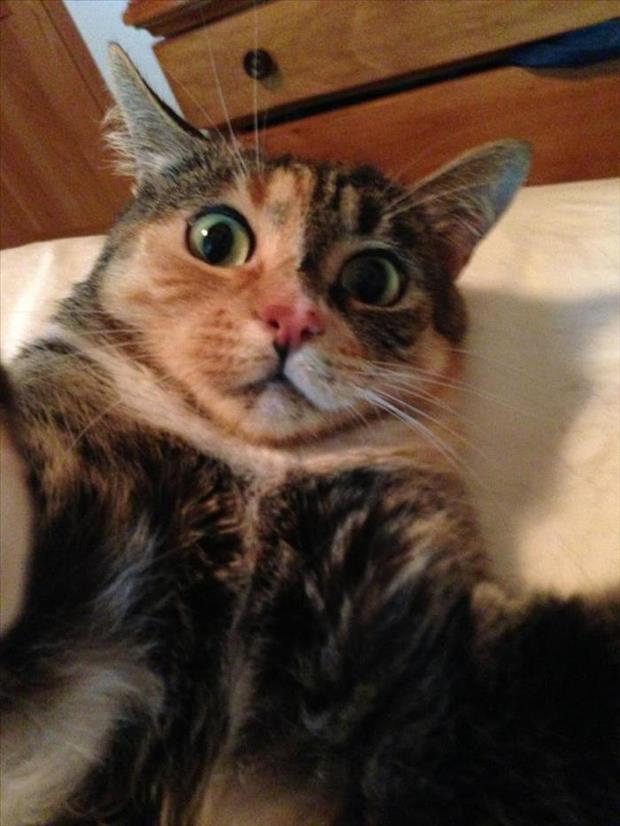
At what (x,y) coordinates should I click in order to perform the action: click on clothes hanging from dresser. Please return your answer as a coordinate pair (x, y). Looking at the image, I should click on (567, 58).